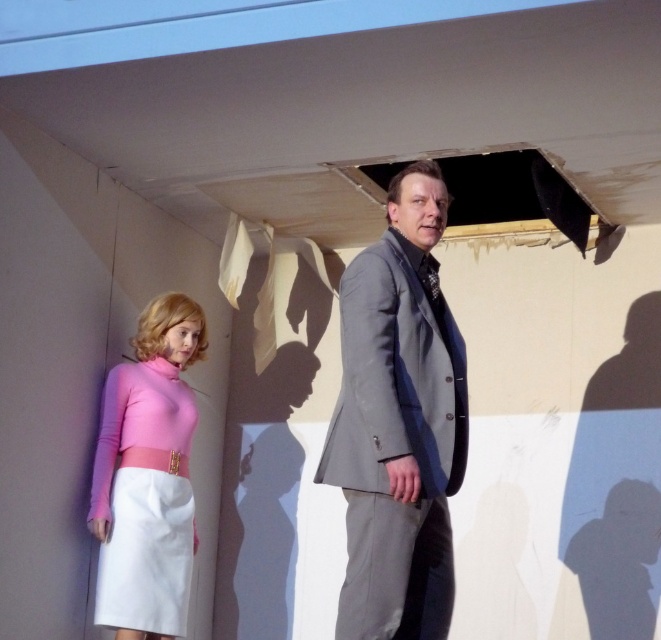
Which is more to the left, gray wool suit at center or pink matte fabric dress at lower left?

From the viewer's perspective, pink matte fabric dress at lower left appears more on the left side.

Can you confirm if gray wool suit at center is thinner than pink matte fabric dress at lower left?

Incorrect, gray wool suit at center's width is not less than pink matte fabric dress at lower left's.

Which is behind, point (399, 592) or point (192, 408)?

Positioned behind is point (192, 408).

At what (x,y) coordinates should I click in order to perform the action: click on gray wool suit at center. Please return your answer as a coordinate pair (x, y). This screenshot has width=661, height=640. Looking at the image, I should click on (399, 422).